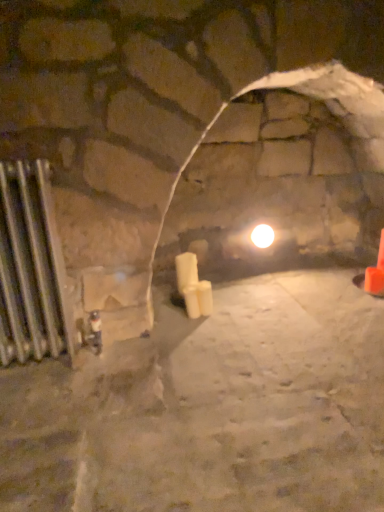
Question: Is white glossy light bulb at center in front of or behind orange plastic traffic cone at right in the image?

Choices:
 (A) behind
 (B) front

Answer: (A)

Question: Looking at their shapes, would you say white glossy light bulb at center is wider or thinner than orange plastic traffic cone at right?

Choices:
 (A) thin
 (B) wide

Answer: (B)

Question: Estimate the real-world distances between objects in this image. Which object is closer to the white glossy light bulb at center?

Choices:
 (A) white matte candle at center
 (B) silver metallic radiator at left
 (C) orange plastic traffic cone at right

Answer: (A)

Question: Which of these objects is positioned farthest from the white glossy light bulb at center?

Choices:
 (A) white matte candle at center
 (B) silver metallic radiator at left
 (C) orange plastic traffic cone at right

Answer: (B)